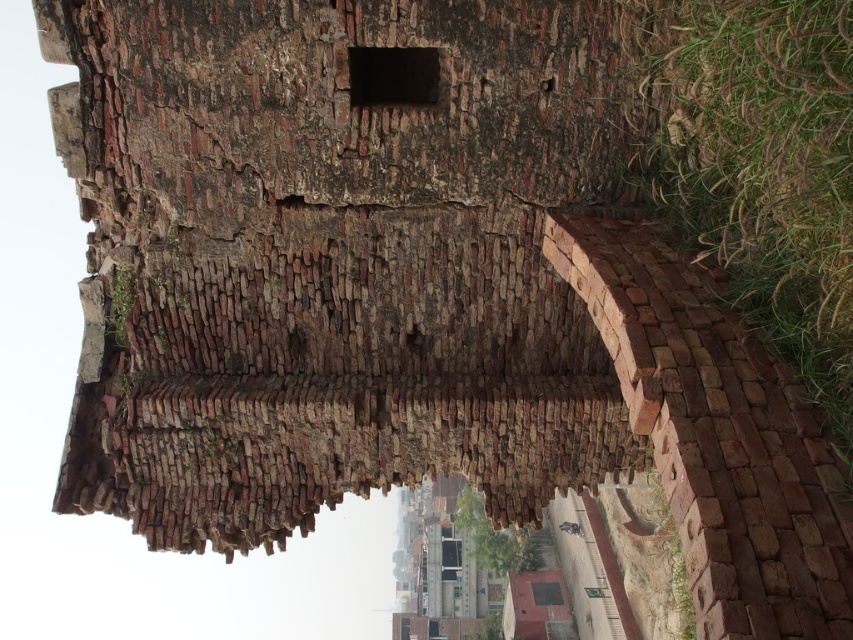
You are a gardener standing in front of the aged brick wall. You need to place a new decorative stone sculpture exactly between the green rough grass at right and the dark gray stone hole at center. Where should you place it?

The green rough grass at right is to the right of the dark gray stone hole at center, so placing the sculpture halfway between them would mean positioning it to the left of the green rough grass at right and to the right of the dark gray stone hole at center.

You are standing in front of the aged brick wall and notice the green rough grass at right and the rustic brick hut at center. Which object is positioned more to the left side of the wall?

The green rough grass at right is positioned to the left of the rustic brick hut at center, so it is more to the left side of the wall.

You are standing in front of an aged brick wall with a curved arch. You notice green rough grass at right and a rustic brick hut at center. Which object is taller?

The rustic brick hut at center is taller than the green rough grass at right.